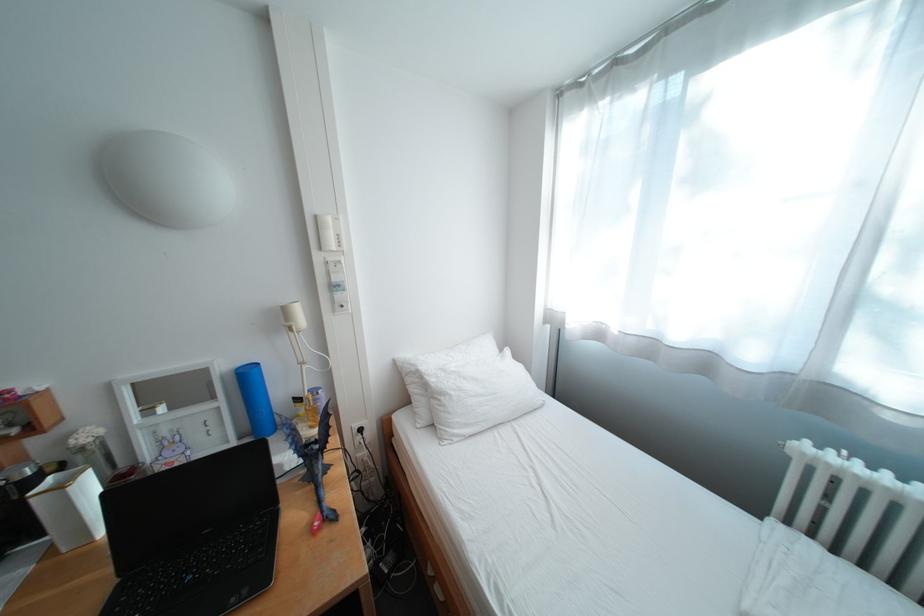
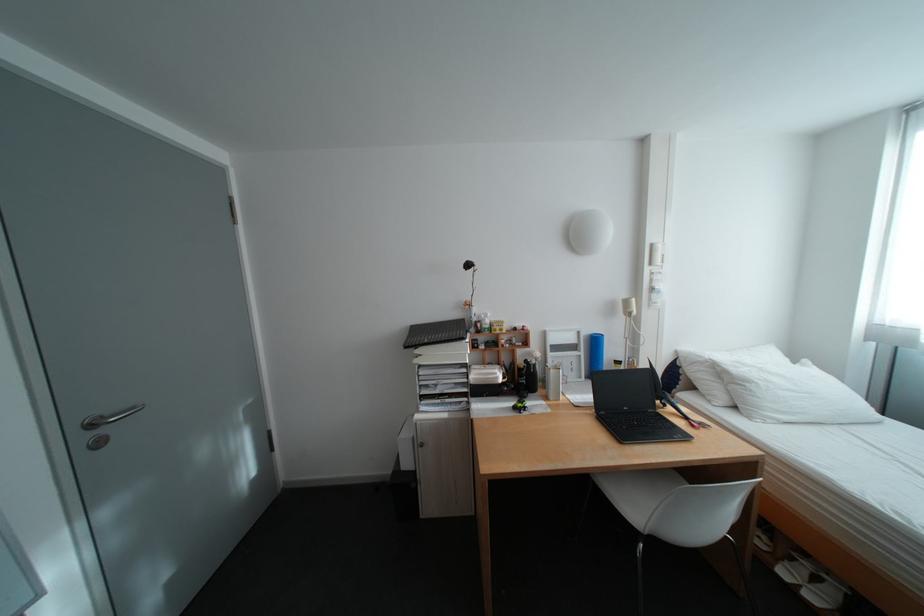
Locate, in the second image, the point that corresponds to (x=234, y=403) in the first image.

(594, 354)